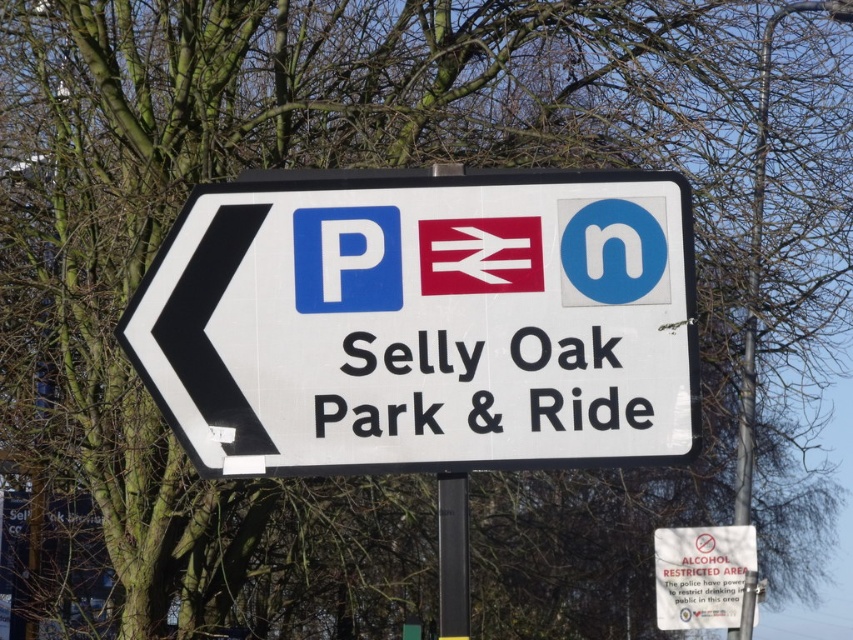
Question: Does white plastic sign at center have a greater width compared to white paper sign at center?

Choices:
 (A) no
 (B) yes

Answer: (B)

Question: Is white plastic sign at center thinner than white paper sign at center?

Choices:
 (A) no
 (B) yes

Answer: (A)

Question: Which point appears closest to the camera in this image?

Choices:
 (A) (685, 548)
 (B) (566, 296)

Answer: (B)

Question: Is white plastic sign at center thinner than white paper sign at center?

Choices:
 (A) yes
 (B) no

Answer: (B)

Question: Among these points, which one is farthest from the camera?

Choices:
 (A) (659, 588)
 (B) (566, 324)

Answer: (A)